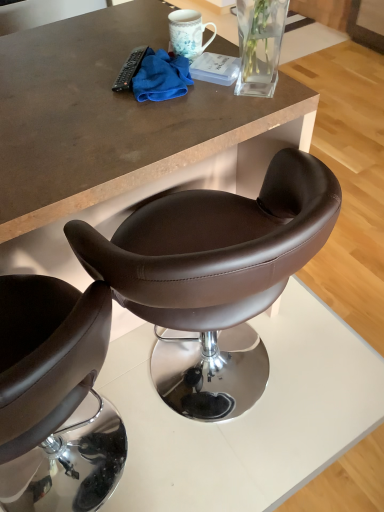
The image size is (384, 512). Find the location of `vacant area that lies to the right of black plastic remote control at upper center`. vacant area that lies to the right of black plastic remote control at upper center is located at coordinates (213, 84).